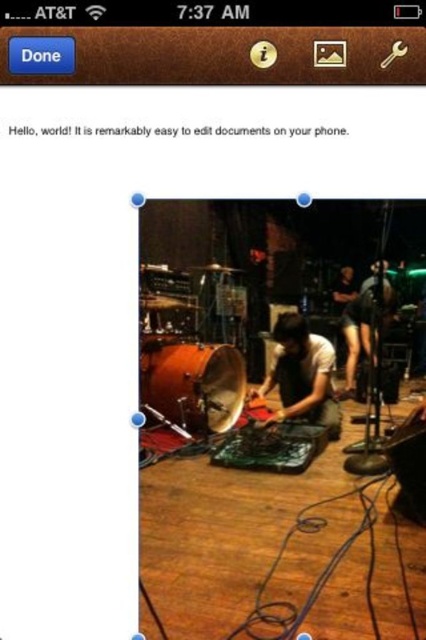
Between matte brown drum at center and dark brown leather jacket at right, which one appears on the left side from the viewer's perspective?

matte brown drum at center

This screenshot has width=426, height=640. Describe the element at coordinates (193, 384) in the screenshot. I see `matte brown drum at center` at that location.

The image size is (426, 640). I want to click on matte brown drum at center, so click(193, 384).

Is matte black shirt at center above dark brown leather jacket at right?

Actually, matte black shirt at center is below dark brown leather jacket at right.

Is point (284, 333) positioned behind point (339, 284)?

No, it is in front of (339, 284).

Is point (316, 420) positioned before point (348, 298)?

Yes, it is.

Find the location of a particular element. The height and width of the screenshot is (640, 426). matte black shirt at center is located at coordinates (302, 374).

How distant is matte black shirt at center from skinny jeans at right?

matte black shirt at center is 5.76 feet away from skinny jeans at right.

Between point (290, 348) and point (360, 300), which one is positioned behind?

The point (360, 300) is behind.

Identify the location of matte black shirt at center. This screenshot has width=426, height=640. (302, 374).